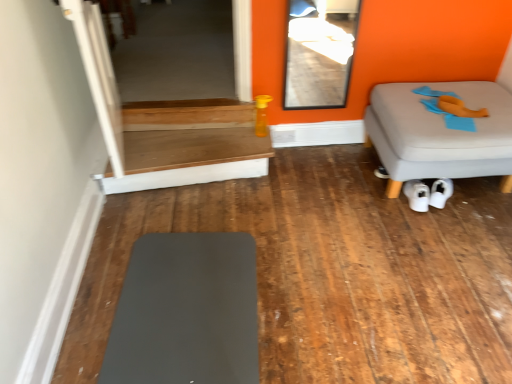
Identify the location of blank space to the left of gray fabric ottoman at right, acting as the 1th furniture starting from the right. The image size is (512, 384). (330, 198).